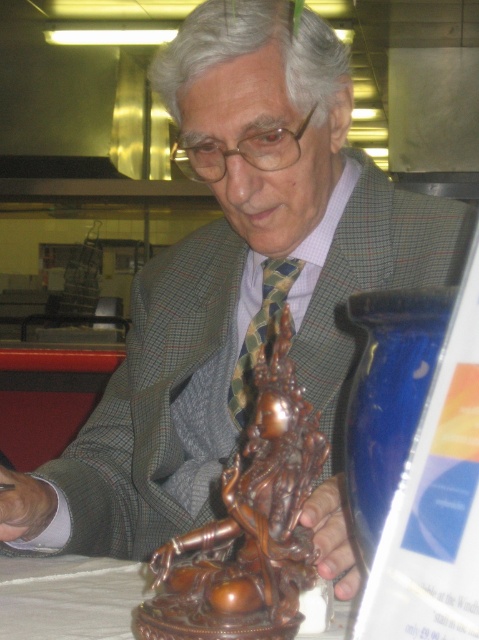
Question: Which of these objects is positioned closest to the green checkered tie at center?

Choices:
 (A) bronze statue at center
 (B) wooden statue at center

Answer: (A)

Question: Among these objects, which one is farthest from the camera?

Choices:
 (A) wooden statue at center
 (B) bronze statue at center
 (C) green checkered tie at center

Answer: (C)

Question: Estimate the real-world distances between objects in this image. Which object is farther from the green checkered tie at center?

Choices:
 (A) wooden statue at center
 (B) bronze statue at center

Answer: (A)

Question: Does wooden statue at center have a lesser width compared to green checkered tie at center?

Choices:
 (A) no
 (B) yes

Answer: (A)

Question: Is bronze statue at center further to the viewer compared to green checkered tie at center?

Choices:
 (A) yes
 (B) no

Answer: (B)

Question: Is wooden statue at center to the right of green checkered tie at center from the viewer's perspective?

Choices:
 (A) yes
 (B) no

Answer: (B)